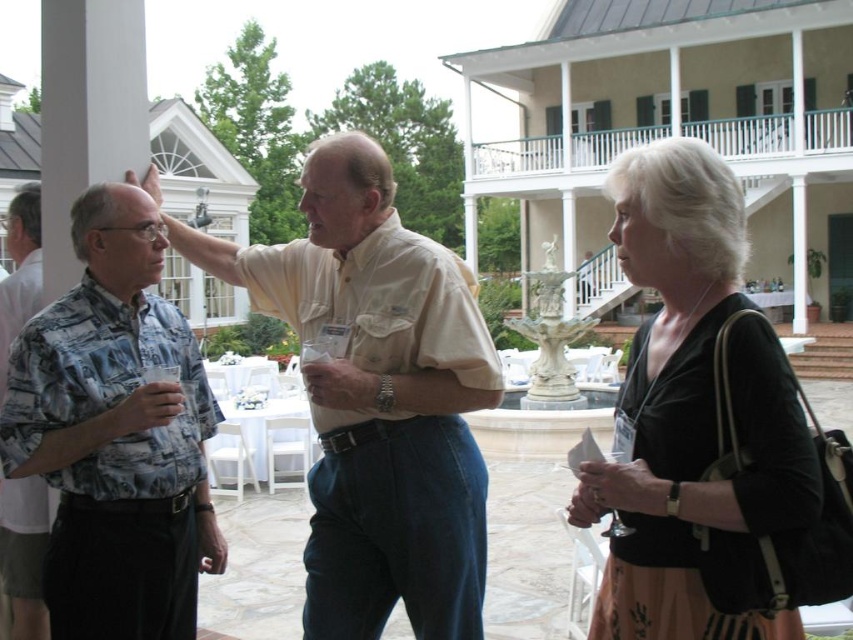
Is point (433, 360) closer to camera compared to point (119, 483)?

No, it is not.

Can you confirm if light beige cotton shirt at center is shorter than printed fabric shirt at center?

No.

Where is `light beige cotton shirt at center`? This screenshot has height=640, width=853. light beige cotton shirt at center is located at coordinates (378, 397).

From the picture: Is light beige cotton shirt at center shorter than white wooden porch at upper center?

No, light beige cotton shirt at center is not shorter than white wooden porch at upper center.

Is point (358, 220) positioned in front of point (751, 150)?

Yes, point (358, 220) is in front of point (751, 150).

What do you see at coordinates (378, 397) in the screenshot? I see `light beige cotton shirt at center` at bounding box center [378, 397].

At what (x,y) coordinates should I click in order to perform the action: click on light beige cotton shirt at center. Please return your answer as a coordinate pair (x, y). Image resolution: width=853 pixels, height=640 pixels. Looking at the image, I should click on (378, 397).

Is white wooden porch at upper center positioned at the back of printed fabric shirt at left?

Yes, it is behind printed fabric shirt at left.

The height and width of the screenshot is (640, 853). Describe the element at coordinates (550, 161) in the screenshot. I see `white wooden porch at upper center` at that location.

At what (x,y) coordinates should I click in order to perform the action: click on white wooden porch at upper center. Please return your answer as a coordinate pair (x, y). Looking at the image, I should click on (550, 161).

You are a GUI agent. You are given a task and a screenshot of the screen. Output one action in this format:
    pyautogui.click(x=<x>, y=<y>)
    Task: Click on the white wooden porch at upper center
    
    Given the screenshot: What is the action you would take?
    pyautogui.click(x=550, y=161)